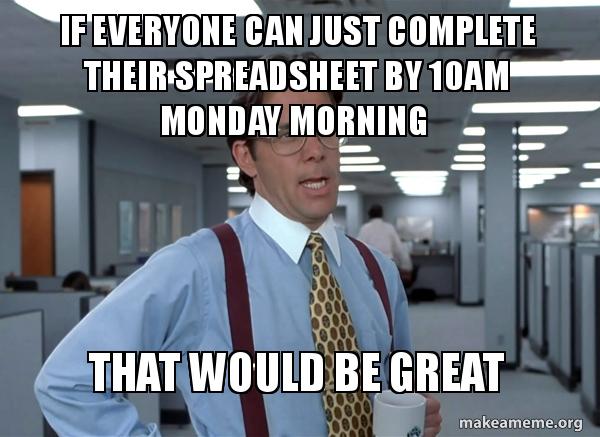
I want to click on glass, so click(x=284, y=141).